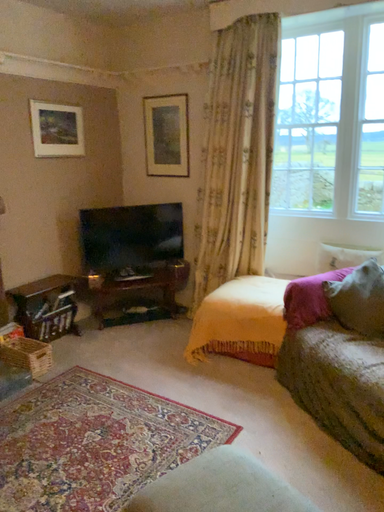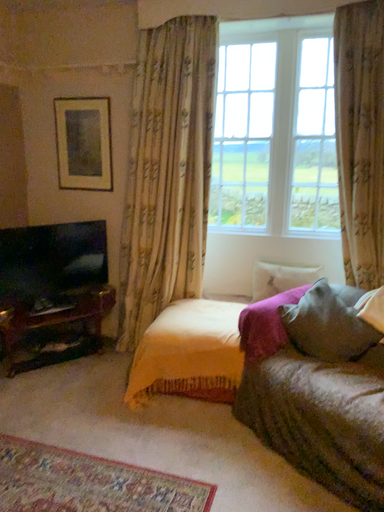
Question: How did the camera likely rotate when shooting the video?

Choices:
 (A) rotated right
 (B) rotated left

Answer: (A)